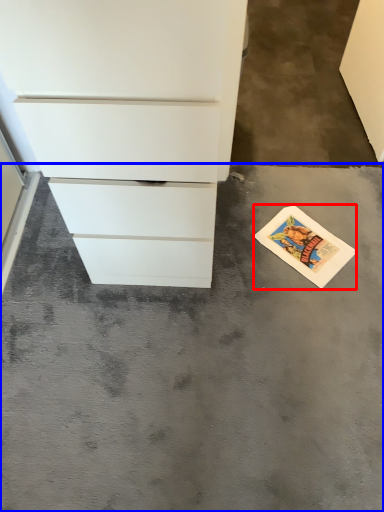
Question: Which of the following is the closest to the observer, postcard (highlighted by a red box) or concrete (highlighted by a blue box)?

Choices:
 (A) postcard
 (B) concrete

Answer: (B)